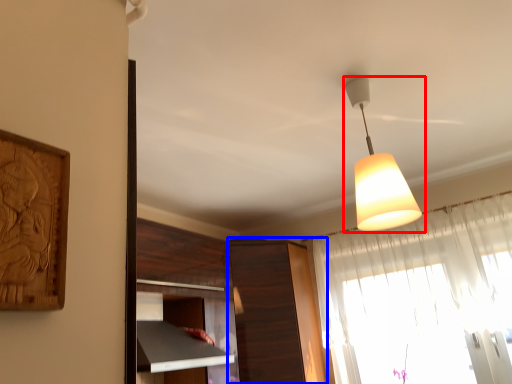
Question: Among these objects, which one is nearest to the camera, lamp (highlighted by a red box) or cabinetry (highlighted by a blue box)?

Choices:
 (A) lamp
 (B) cabinetry

Answer: (A)